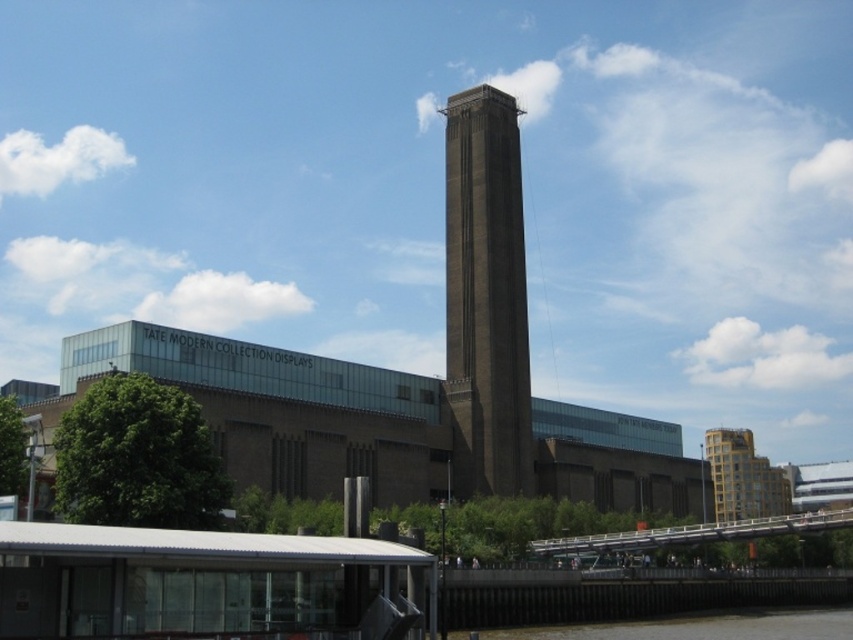
Who is taller, brown stone tower at center or brown concrete river at lower center?

With more height is brown stone tower at center.

At what (x,y) coordinates should I click in order to perform the action: click on brown stone tower at center. Please return your answer as a coordinate pair (x, y). This screenshot has height=640, width=853. Looking at the image, I should click on (485, 296).

Who is more forward, [463,198] or [764,609]?

Positioned in front is point [764,609].

The width and height of the screenshot is (853, 640). Find the location of `brown stone tower at center`. brown stone tower at center is located at coordinates (485, 296).